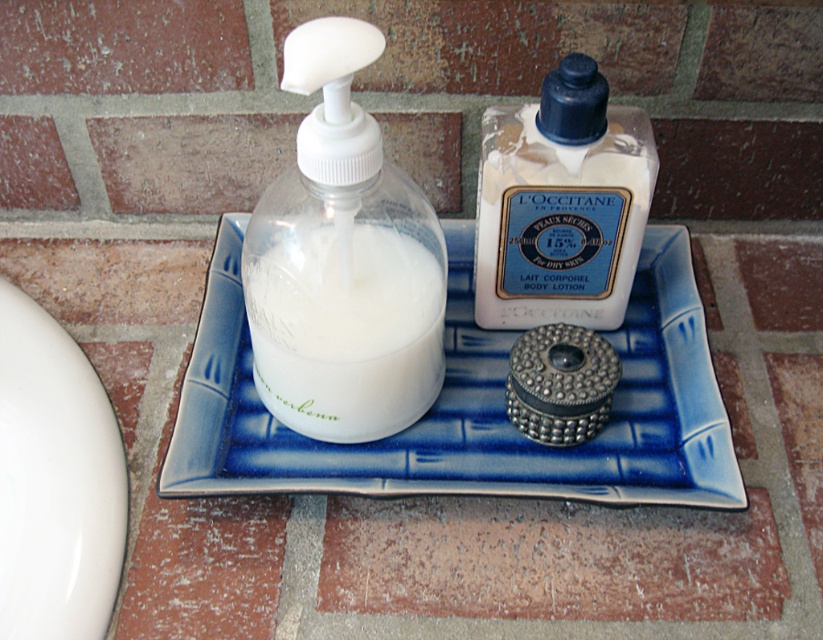
Is white opaque liquid at center behind white matte lotion at center?

No, white opaque liquid at center is in front of white matte lotion at center.

Which is in front, point (402, 410) or point (547, 198)?

Point (547, 198) is more forward.

At what (x,y) coordinates should I click in order to perform the action: click on white opaque liquid at center. Please return your answer as a coordinate pair (x, y). This screenshot has height=640, width=823. Looking at the image, I should click on (346, 332).

Find the location of a particular element. Image resolution: width=823 pixels, height=640 pixels. white glossy plate at lower left is located at coordinates (54, 481).

At what (x,y) coordinates should I click in order to perform the action: click on white glossy plate at lower left. Please return your answer as a coordinate pair (x, y). The image size is (823, 640). Looking at the image, I should click on (54, 481).

You are a GUI agent. You are given a task and a screenshot of the screen. Output one action in this format:
    pyautogui.click(x=<x>, y=<y>)
    Task: Click on the white glossy plate at lower left
    The width and height of the screenshot is (823, 640).
    Given the screenshot: What is the action you would take?
    pyautogui.click(x=54, y=481)

Can you confirm if blue ceramic tray at center is positioned above white matte lotion at center?

No, blue ceramic tray at center is not above white matte lotion at center.

Is point (617, 404) farther from camera compared to point (512, 172)?

Yes, it is behind point (512, 172).

The height and width of the screenshot is (640, 823). Identify the location of blue ceramic tray at center. (472, 404).